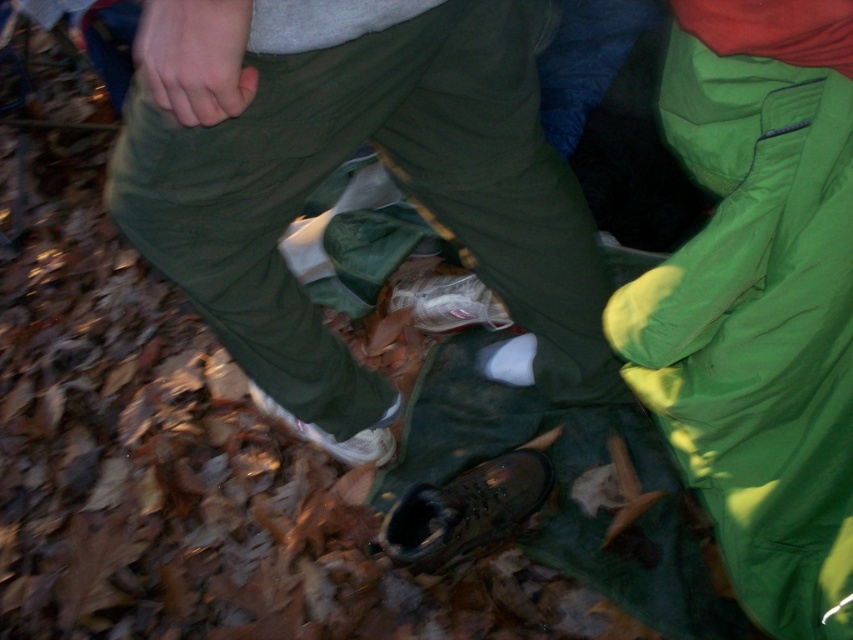
Question: Is green matte pants at center positioned in front of white matte shoe at lower center?

Choices:
 (A) no
 (B) yes

Answer: (B)

Question: Does leather boot at lower center appear on the left side of translucent plastic shoe at center?

Choices:
 (A) yes
 (B) no

Answer: (B)

Question: Based on their relative distances, which object is farther from the leather boot at lower center?

Choices:
 (A) white matte shoe at lower center
 (B) translucent plastic shoe at center
 (C) green matte pants at center

Answer: (B)

Question: Which object appears closest to the camera in this image?

Choices:
 (A) leather boot at lower center
 (B) green matte pants at center

Answer: (B)

Question: Which of the following is the closest to the observer?

Choices:
 (A) (248, 385)
 (B) (202, 234)
 (C) (514, 500)

Answer: (B)

Question: Does green matte pants at center have a lesser width compared to translucent plastic shoe at center?

Choices:
 (A) yes
 (B) no

Answer: (B)